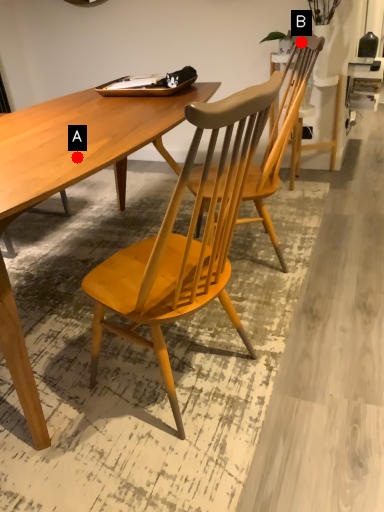
Question: Two points are circled on the image, labeled by A and B beside each circle. Which point is closer to the camera?

Choices:
 (A) A is closer
 (B) B is closer

Answer: (A)